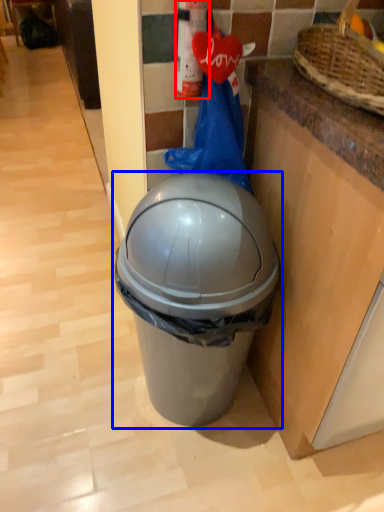
Question: Which object appears farthest to the camera in this image, extinguisher (highlighted by a red box) or waste container (highlighted by a blue box)?

Choices:
 (A) extinguisher
 (B) waste container

Answer: (A)